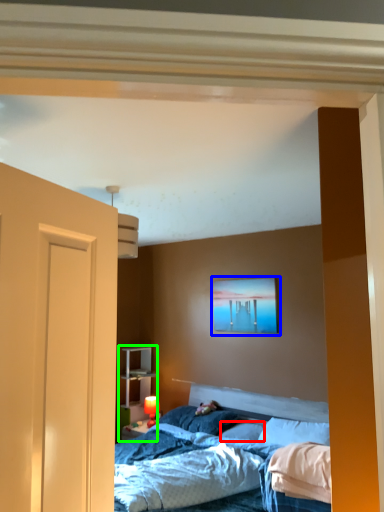
Question: Which is nearer to the pillow (highlighted by a red box)? picture frame (highlighted by a blue box) or dresser (highlighted by a green box).

Choices:
 (A) picture frame
 (B) dresser

Answer: (A)